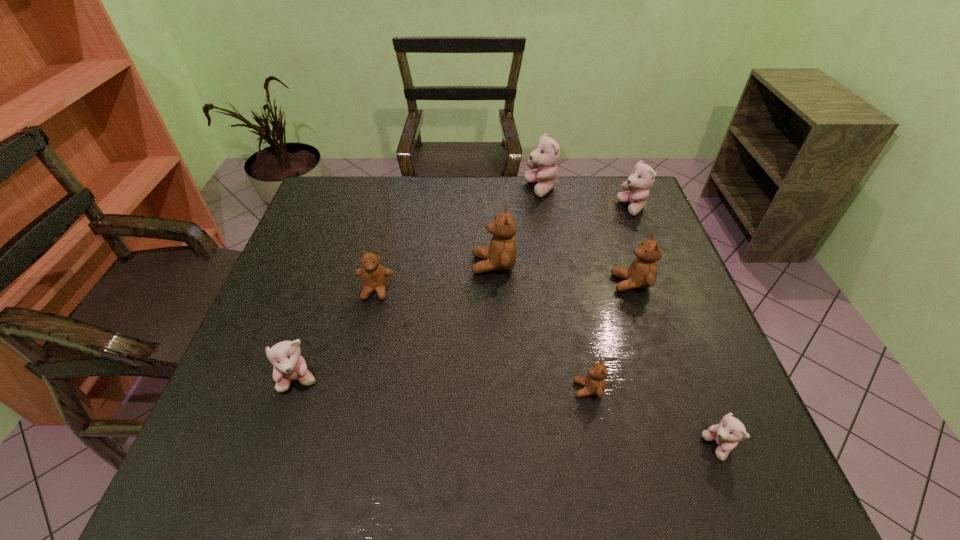
What are the coordinates of `the nearest brown teddy bear` in the screenshot? It's located at (594, 383).

You are a GUI agent. You are given a task and a screenshot of the screen. Output one action in this format:
    pyautogui.click(x=<x>, y=<y>)
    Task: Click on the nearest pink teddy bear
    
    Given the screenshot: What is the action you would take?
    pyautogui.click(x=726, y=434)

I want to click on the nearest object, so click(x=726, y=434).

Locate an element on the screen. This screenshot has height=540, width=960. vacant area located at the face of the third pink teddy bear from right to left is located at coordinates (424, 189).

I want to click on vacant point located 0.160m at the face of the third pink teddy bear from right to left, so click(x=476, y=189).

This screenshot has width=960, height=540. Identify the location of vacant space located at the face of the third pink teddy bear from right to left. (497, 189).

Where is `vacant space positioned on the face of the biggest brown teddy bear`? vacant space positioned on the face of the biggest brown teddy bear is located at coordinates coord(453,265).

Locate an element on the screen. This screenshot has width=960, height=540. vacant space located on the face of the biggest brown teddy bear is located at coordinates (380, 265).

Identify the location of vacant space situated on the face of the biggest brown teddy bear. (324, 265).

Find the location of a particular element. vacant space located 0.280m at the face of the second biggest pink teddy bear is located at coordinates (528, 208).